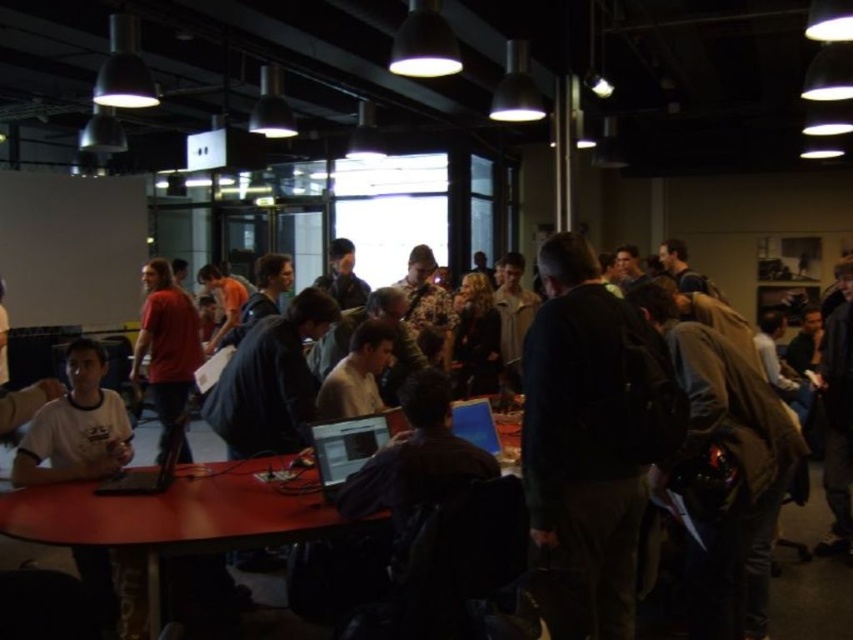
You are standing in the workspace and want to greet both the person wearing the dark green jacket at center and the person in the matte red shirt at left. Which individual should you approach first to reach them in the shortest distance?

You should approach the dark green jacket at center first because it is closer to you than the matte red shirt at left, so reaching it requires less distance.

You are a person with a 12 inch long notebook. You want to place your notebook next to the matte black laptop at center on the wooden table at center. Is there enough space between them to fit your notebook?

The wooden table at center is 12.92 inches away from the matte black laptop at center. Since your notebook is 12 inches long, there is enough space between them to fit your notebook.

You are standing at the entrance of the workspace and want to locate the wooden table at center. According to the coordinates provided, in which direction should you move from the entrance to reach it?

The wooden table at center is located at coordinates point [173,513]. Since the entrance is not specified in the scene description, it is impossible to determine the exact direction to move from the entrance to reach the wooden table at center.